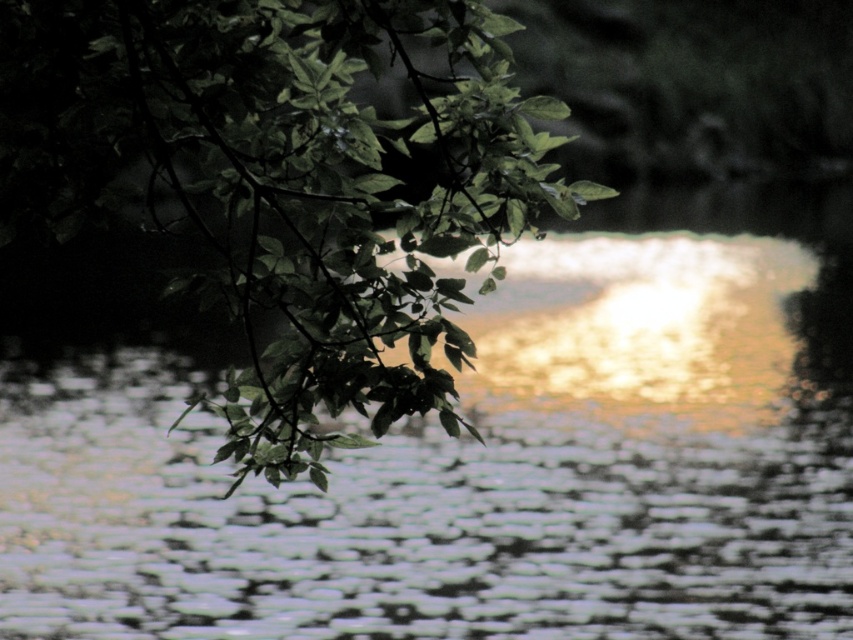
You are an artist trying to paint the scene. You want to ensure the glistening water at center and the green leafy branch at upper left are proportionally accurate. Which object should you paint smaller?

The glistening water at center should be painted smaller than the green leafy branch at upper left because it has a smaller size compared to the branch.

You are standing at the edge of the scene and want to reach the glistening water at center. Which direction should you move to get there?

The glistening water at center is located at point 0.720 on the x and 0.573 on the y coordinate, so you should move towards the center of the scene to reach it.

You are standing at the edge of the water and want to reach the point marked as point [839,600]. If your walking speed is 1.5 meters per second, how long will it take you to reach that point?

The distance of point [839,600] from camera is 9.30 meters. At a walking speed of 1.5 meters per second, it will take approximately 6.2 seconds to reach the point.